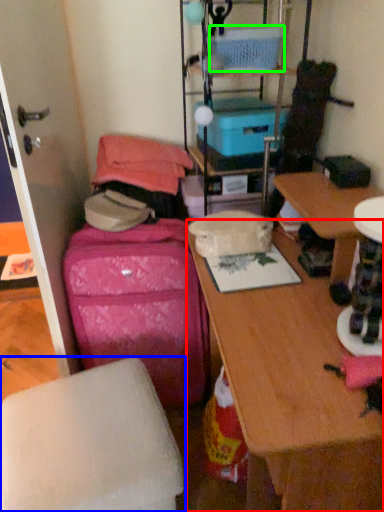
Question: Considering the real-world distances, which object is closest to desk (highlighted by a red box)? furniture (highlighted by a blue box) or storage box (highlighted by a green box).

Choices:
 (A) furniture
 (B) storage box

Answer: (A)